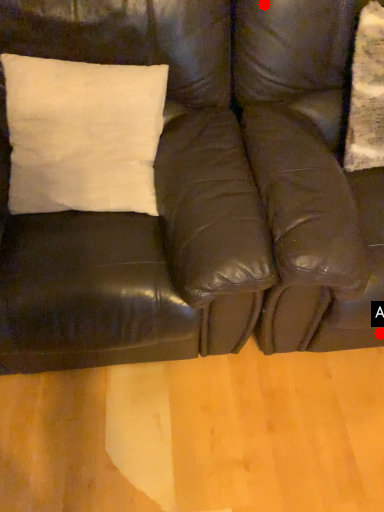
Question: Two points are circled on the image, labeled by A and B beside each circle. Which point is closer to the camera taking this photo?

Choices:
 (A) A is closer
 (B) B is closer

Answer: (B)